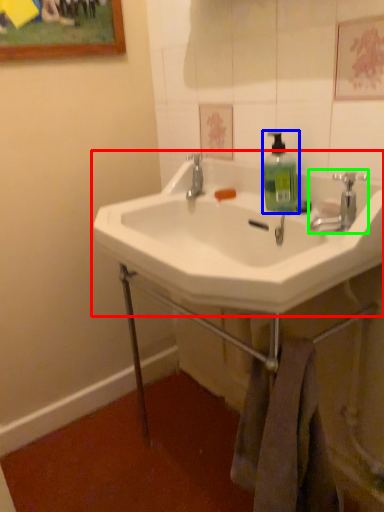
Question: Considering the real-world distances, which object is farthest from sink (highlighted by a red box)? soap dispenser (highlighted by a blue box) or tap (highlighted by a green box)?

Choices:
 (A) soap dispenser
 (B) tap

Answer: (B)